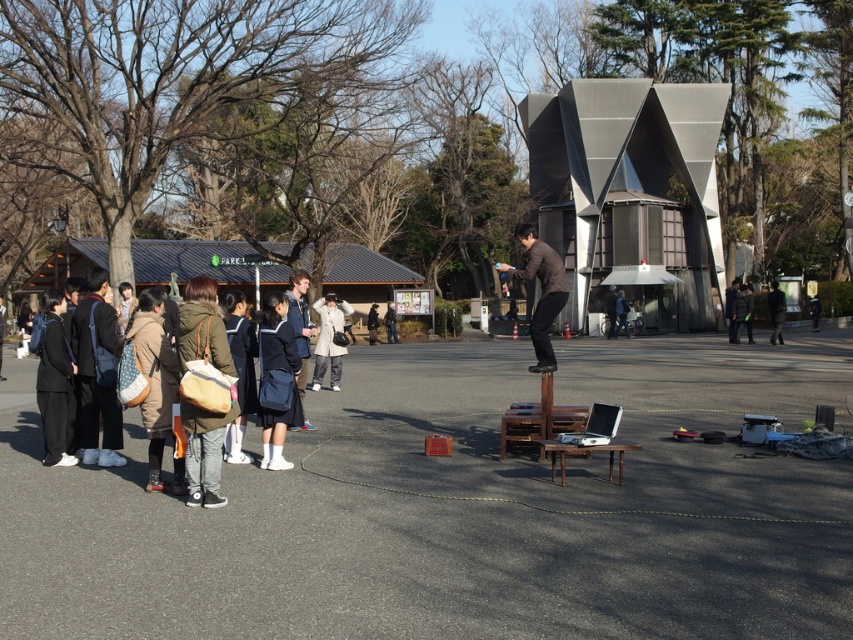
Which of these two, dark blue jacket at left or brown leather jacket at center, stands taller?

Standing taller between the two is brown leather jacket at center.

Who is lower down, dark blue jacket at left or brown leather jacket at center?

dark blue jacket at left is below.

From the picture: Measure the distance between dark blue jacket at left and camera.

dark blue jacket at left and camera are 8.78 meters apart from each other.

Image resolution: width=853 pixels, height=640 pixels. Find the location of `dark blue jacket at left`. dark blue jacket at left is located at coordinates (97, 372).